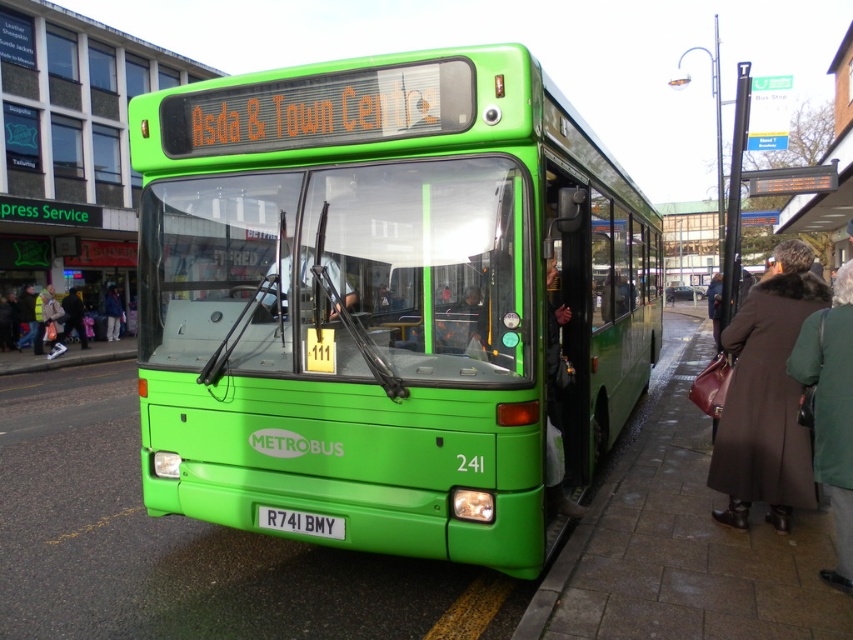
You are a tailor who needs to determine which garment requires more fabric for a similar design. Based on the image, which garment between the green fabric coat at right and the dark blue jacket at center would need more fabric?

The dark blue jacket at center requires more fabric because the green fabric coat at right is narrower than the dark blue jacket at center.

Where is the white plastic license plate at center located in the image?

The white plastic license plate at center is located at point coordinates of 0.817 on the x axis and 0.353 on the y axis.